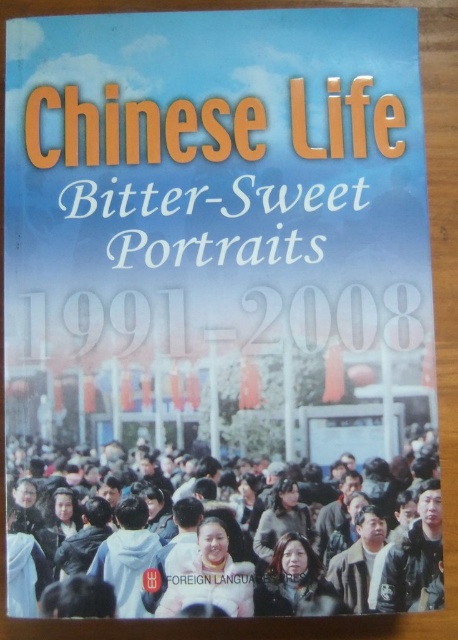
Is matte paper book at center behind dark brown hair at center?

Yes, it is behind dark brown hair at center.

Who is positioned more to the left, matte paper book at center or dark brown hair at center?

matte paper book at center is more to the left.

Find the location of a particular element. Image resolution: width=458 pixels, height=640 pixels. matte paper book at center is located at coordinates (218, 230).